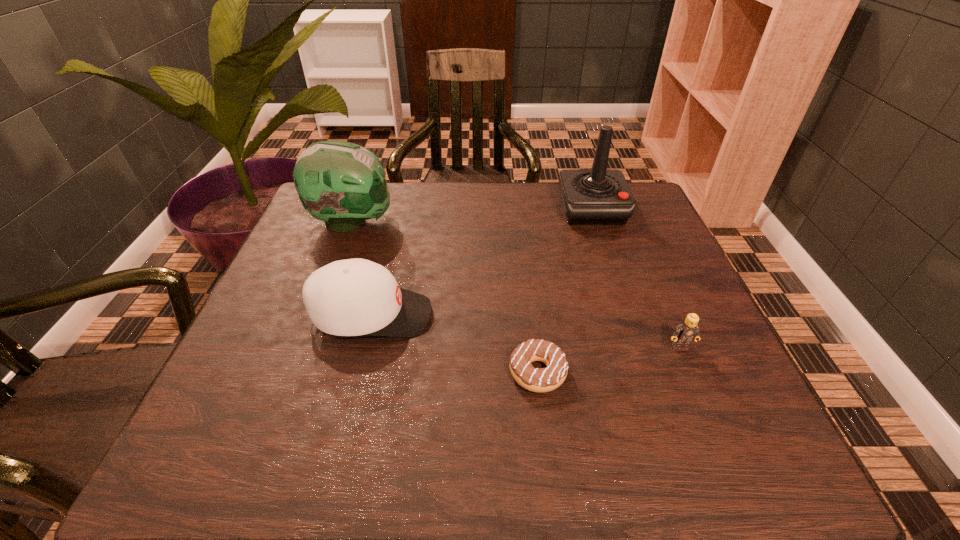
Image resolution: width=960 pixels, height=540 pixels. What are the coordinates of `vacant space that is in between the Lego and the shortest object` in the screenshot? It's located at (609, 360).

Locate an element on the screen. The image size is (960, 540). blank region between the third object from right to left and the football helmet is located at coordinates (444, 297).

At what (x,y) coordinates should I click in order to perform the action: click on vacant space that's between the second shortest object and the joystick. Please return your answer as a coordinate pair (x, y). Image resolution: width=960 pixels, height=540 pixels. Looking at the image, I should click on (636, 278).

At what (x,y) coordinates should I click in order to perform the action: click on the closest object to the football helmet. Please return your answer as a coordinate pair (x, y). This screenshot has height=540, width=960. Looking at the image, I should click on (352, 297).

The width and height of the screenshot is (960, 540). In order to click on the fourth closest object to the football helmet in this screenshot , I will do `click(685, 333)`.

This screenshot has width=960, height=540. Identify the location of free space that satisfies the following two spatial constraints: 1. on the back side of the doughnut; 2. on the front-facing side of the baseball cap. (531, 315).

Where is `vacant space that satisfies the following two spatial constraints: 1. on the visor of the football helmet; 2. on the back side of the third object from right to left`? The image size is (960, 540). vacant space that satisfies the following two spatial constraints: 1. on the visor of the football helmet; 2. on the back side of the third object from right to left is located at coordinates (296, 372).

Locate an element on the screen. The image size is (960, 540). blank space that satisfies the following two spatial constraints: 1. on the front-facing side of the joystick; 2. on the visor of the football helmet is located at coordinates (596, 222).

The height and width of the screenshot is (540, 960). In order to click on free space that satisfies the following two spatial constraints: 1. on the front-facing side of the joystick; 2. on the front-facing side of the third tallest object in this screenshot , I will do `click(628, 315)`.